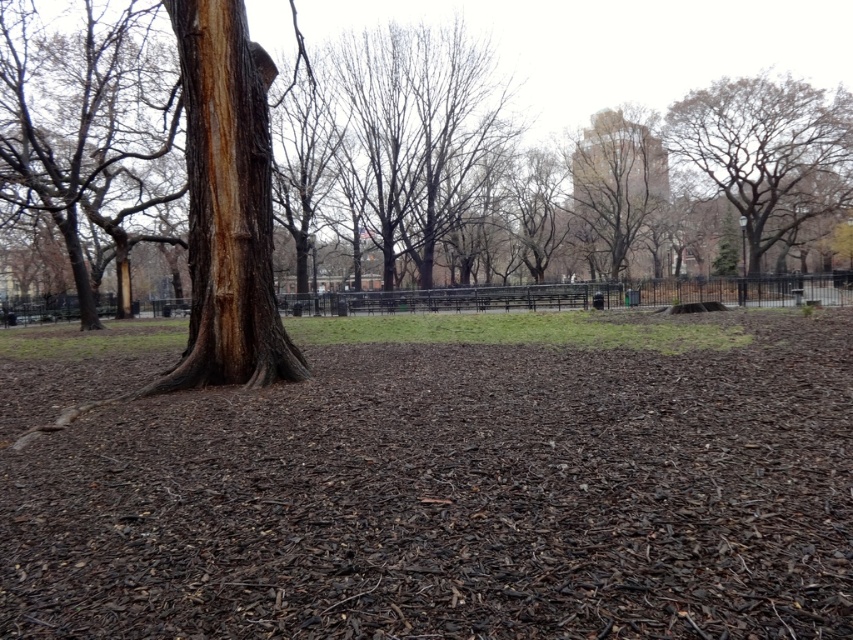
You are standing at the entrance of the park and want to find the brown mulch at center. According to the coordinates provided, in which direction should you walk from the entrance to reach it?

The brown mulch at center is located at coordinates point (456, 497). Since the entrance is typically at the edge of the park, you should walk towards the center of the park to reach it.

You are a park visitor standing in the middle of the park. You see the rough bark tree at center and the brown rough bark tree trunk at left. Which tree would appear taller to you?

The rough bark tree at center is taller than the brown rough bark tree trunk at left, so it would appear taller to you.